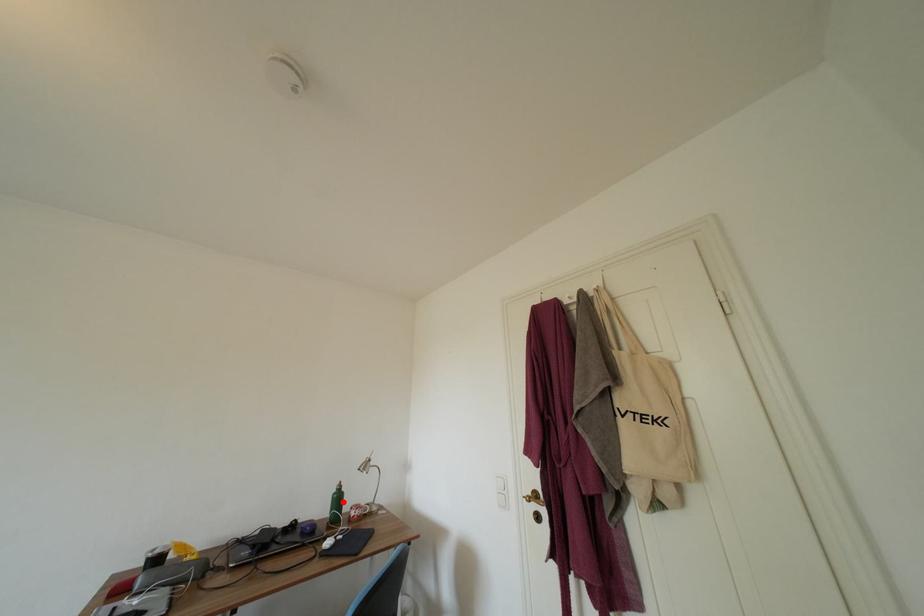
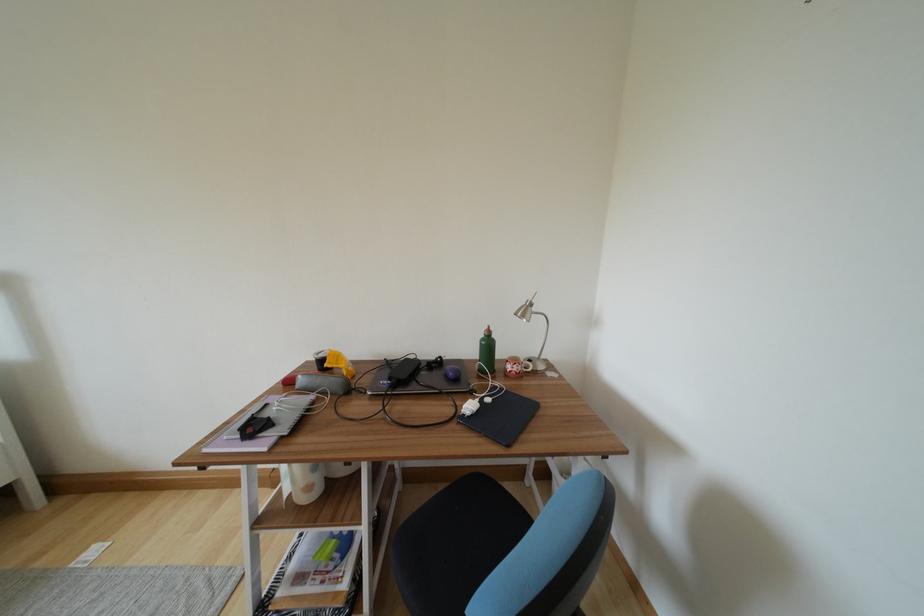
Question: I am providing you with two images of the same scene from different viewpoints. A red point is shown in image1. For the corresponding object point in image2, is it positioned nearer or farther from the camera?

Choices:
 (A) Nearer
 (B) Farther

Answer: (A)